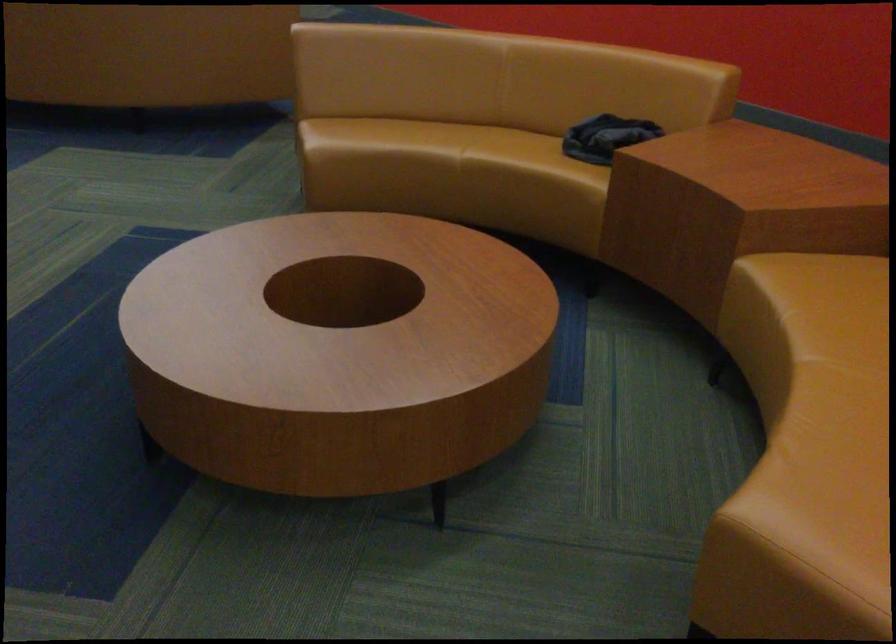
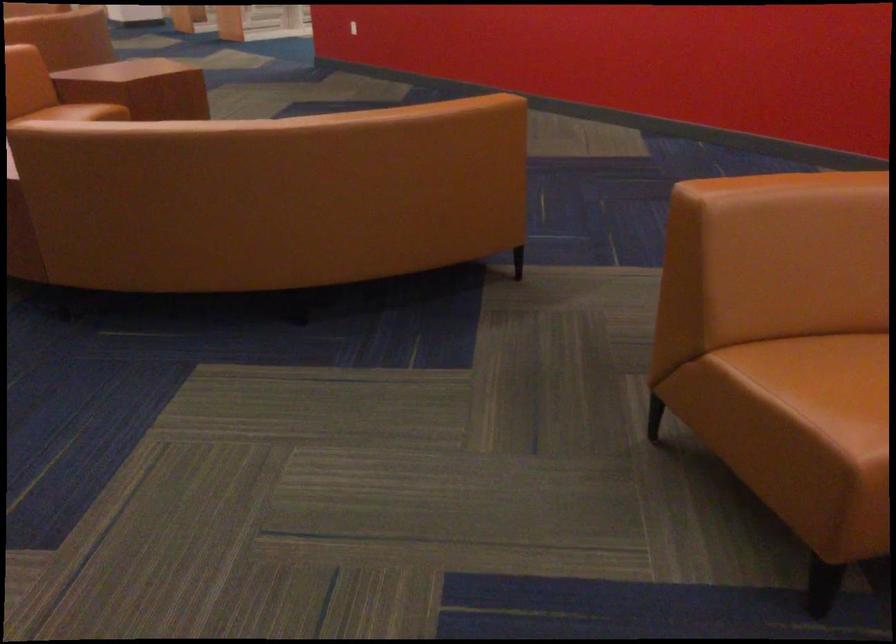
Which direction would the cameraman need to move to produce the second image?

The cameraman moved toward left, forward.